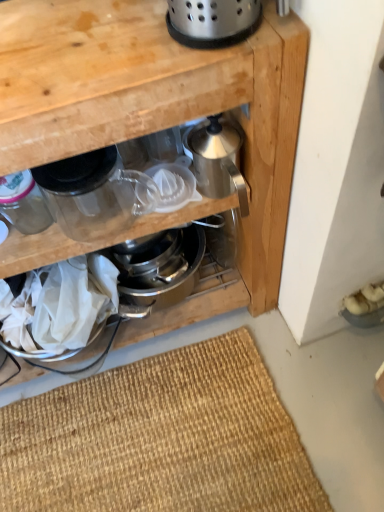
I want to click on transparent plastic juicer at center, which is counted as the 3th appliance, starting from the right, so click(166, 189).

What is the approximate width of transparent glass jar at left, the fourth appliance positioned from the right?

It is 3.05 inches.

This screenshot has height=512, width=384. Find the location of `polished stainless steel colander at upper center, marked as the second appliance in a right-to-left arrangement`. polished stainless steel colander at upper center, marked as the second appliance in a right-to-left arrangement is located at coordinates (212, 21).

The image size is (384, 512). Find the location of `cabinetry in front of the stainless steel kettle at center, the 1th appliance viewed from the right`. cabinetry in front of the stainless steel kettle at center, the 1th appliance viewed from the right is located at coordinates (158, 112).

Considering the sizes of objects satin silver juicer at center and stainless steel kettle at center, the 1th appliance viewed from the right, in the image provided, who is taller, satin silver juicer at center or stainless steel kettle at center, the 1th appliance viewed from the right,?

satin silver juicer at center.

Is satin silver juicer at center to the right of stainless steel kettle at center, the 1th appliance viewed from the right, from the viewer's perspective?

No, satin silver juicer at center is not to the right of stainless steel kettle at center, the 1th appliance viewed from the right.

Is point (189, 63) closer or farther from the camera than point (202, 173)?

Point (189, 63).

How different are the orientations of stainless steel kettle at center, which ranks as the 4th appliance in left-to-right order, and polished stainless steel colander at upper center, which ranks as the third appliance in left-to-right order, in degrees?

There is a 8.95-degree angle between the facing directions of stainless steel kettle at center, which ranks as the 4th appliance in left-to-right order, and polished stainless steel colander at upper center, which ranks as the third appliance in left-to-right order.

Is stainless steel kettle at center, the 1th appliance viewed from the right, situated inside polished stainless steel colander at upper center, marked as the second appliance in a right-to-left arrangement, or outside?

stainless steel kettle at center, the 1th appliance viewed from the right, is outside polished stainless steel colander at upper center, marked as the second appliance in a right-to-left arrangement.

From a real-world perspective, who is located higher, stainless steel kettle at center, which ranks as the 4th appliance in left-to-right order, or polished stainless steel colander at upper center, which ranks as the third appliance in left-to-right order?

In real-world perspective, polished stainless steel colander at upper center, which ranks as the third appliance in left-to-right order, is above.

Could brown woven mat at lower center be considered to be inside stainless steel kettle at center, which ranks as the 4th appliance in left-to-right order?

No, brown woven mat at lower center is not inside stainless steel kettle at center, which ranks as the 4th appliance in left-to-right order.

Between stainless steel kettle at center, the 1th appliance viewed from the right, and brown woven mat at lower center, which one appears on the right side from the viewer's perspective?

brown woven mat at lower center.

From the image's perspective, does stainless steel kettle at center, which ranks as the 4th appliance in left-to-right order, appear higher than brown woven mat at lower center?

Yes, from the image's perspective, stainless steel kettle at center, which ranks as the 4th appliance in left-to-right order, is above brown woven mat at lower center.

Considering the relative sizes of stainless steel kettle at center, the 1th appliance viewed from the right, and brown woven mat at lower center in the image provided, is stainless steel kettle at center, the 1th appliance viewed from the right, smaller than brown woven mat at lower center?

Yes.

Is transparent glass jar at left, the first appliance viewed from the left, next to transparent plastic juicer at center, marked as the 2th appliance in a left-to-right arrangement, and touching it?

No.

Does point (27, 169) appear closer or farther from the camera than point (173, 189)?

Point (27, 169) is closer to the camera than point (173, 189).

Does transparent glass jar at left, the fourth appliance positioned from the right, come in front of transparent plastic juicer at center, marked as the 2th appliance in a left-to-right arrangement?

That is True.

Is satin silver juicer at center located outside transparent plastic juicer at center, which is counted as the 3th appliance, starting from the right?

satin silver juicer at center lies outside transparent plastic juicer at center, which is counted as the 3th appliance, starting from the right,'s area.

Considering the positions of objects satin silver juicer at center and transparent plastic juicer at center, marked as the 2th appliance in a left-to-right arrangement, in the image provided, who is more to the left, satin silver juicer at center or transparent plastic juicer at center, marked as the 2th appliance in a left-to-right arrangement,?

Positioned to the left is satin silver juicer at center.

Is point (104, 138) positioned after point (172, 166)?

That is False.

Does satin silver juicer at center have a lesser width compared to transparent plastic juicer at center, marked as the 2th appliance in a left-to-right arrangement?

In fact, satin silver juicer at center might be wider than transparent plastic juicer at center, marked as the 2th appliance in a left-to-right arrangement.

From a real-world perspective, which is physically above, transparent glass jar at left, the fourth appliance positioned from the right, or satin silver juicer at center?

transparent glass jar at left, the fourth appliance positioned from the right, is physically above.

Based on the photo, which is more distant, (40, 215) or (90, 97)?

The point (40, 215) is farther from the camera.

At what (x,y) coordinates should I click in order to perform the action: click on the 2nd appliance behind the satin silver juicer at center, counting from the anchor's position. Please return your answer as a coordinate pair (x, y). The image size is (384, 512). Looking at the image, I should click on (23, 203).

Could you measure the distance between transparent glass jar at left, the fourth appliance positioned from the right, and satin silver juicer at center?

They are 9.89 inches apart.

Is brown woven mat at lower center closer to the viewer compared to transparent glass jar at left, the fourth appliance positioned from the right?

No, it is behind transparent glass jar at left, the fourth appliance positioned from the right.

Is transparent glass jar at left, the first appliance viewed from the left, at the back of brown woven mat at lower center?

No, brown woven mat at lower center's orientation is not away from transparent glass jar at left, the first appliance viewed from the left.

Is there a large distance between brown woven mat at lower center and transparent glass jar at left, the fourth appliance positioned from the right?

No, there isn't a large distance between brown woven mat at lower center and transparent glass jar at left, the fourth appliance positioned from the right.

Where is `cabinetry beneath the stainless steel kettle at center, which ranks as the 4th appliance in left-to-right order (from a real-world perspective)`? The height and width of the screenshot is (512, 384). cabinetry beneath the stainless steel kettle at center, which ranks as the 4th appliance in left-to-right order (from a real-world perspective) is located at coordinates (158, 112).

Find the location of a particular element. the 1st appliance below the polished stainless steel colander at upper center, which ranks as the third appliance in left-to-right order (from the image's perspective) is located at coordinates (215, 155).

Based on their spatial positions, is transparent plastic juicer at center, marked as the 2th appliance in a left-to-right arrangement, or brown woven mat at lower center closer to stainless steel kettle at center, which ranks as the 4th appliance in left-to-right order?

transparent plastic juicer at center, marked as the 2th appliance in a left-to-right arrangement.

Estimate the real-world distances between objects in this image. Which object is further from polished stainless steel colander at upper center, which ranks as the third appliance in left-to-right order, transparent glass jar at left, the first appliance viewed from the left, or brown woven mat at lower center?

brown woven mat at lower center.

Based on their spatial positions, is stainless steel kettle at center, the 1th appliance viewed from the right, or polished stainless steel colander at upper center, which ranks as the third appliance in left-to-right order, closer to transparent glass jar at upper left?

stainless steel kettle at center, the 1th appliance viewed from the right, is positioned closer to the anchor transparent glass jar at upper left.

Looking at the image, which one is located further to stainless steel kettle at center, the 1th appliance viewed from the right, transparent glass jar at upper left or transparent plastic juicer at center, which is counted as the 3th appliance, starting from the right?

transparent glass jar at upper left is further to stainless steel kettle at center, the 1th appliance viewed from the right.

Based on their spatial positions, is transparent glass jar at upper left or stainless steel kettle at center, the 1th appliance viewed from the right, closer to brown woven mat at lower center?

Based on the image, transparent glass jar at upper left appears to be nearer to brown woven mat at lower center.

Which object lies further to the anchor point transparent plastic juicer at center, which is counted as the 3th appliance, starting from the right, transparent glass jar at upper left or transparent glass jar at left, the fourth appliance positioned from the right?

transparent glass jar at left, the fourth appliance positioned from the right, lies further to transparent plastic juicer at center, which is counted as the 3th appliance, starting from the right, than the other object.

From the image, which object appears to be farther from polished stainless steel colander at upper center, marked as the second appliance in a right-to-left arrangement, satin silver juicer at center or transparent glass jar at left, the fourth appliance positioned from the right?

transparent glass jar at left, the fourth appliance positioned from the right, is positioned further to the anchor polished stainless steel colander at upper center, marked as the second appliance in a right-to-left arrangement.

Consider the image. Estimate the real-world distances between objects in this image. Which object is further from transparent glass jar at left, the first appliance viewed from the left, polished stainless steel colander at upper center, marked as the second appliance in a right-to-left arrangement, or transparent plastic juicer at center, which is counted as the 3th appliance, starting from the right?

polished stainless steel colander at upper center, marked as the second appliance in a right-to-left arrangement.

Locate an element on the screen. This screenshot has width=384, height=512. appliance between transparent glass jar at left, the fourth appliance positioned from the right, and polished stainless steel colander at upper center, marked as the second appliance in a right-to-left arrangement is located at coordinates (166, 189).

The width and height of the screenshot is (384, 512). I want to click on cabinetry between transparent glass jar at left, the fourth appliance positioned from the right, and brown woven mat at lower center from top to bottom, so click(158, 112).

I want to click on kitchen appliance between polished stainless steel colander at upper center, marked as the second appliance in a right-to-left arrangement, and brown woven mat at lower center in the up-down direction, so click(x=90, y=193).

Locate an element on the screen. Image resolution: width=384 pixels, height=512 pixels. kitchen appliance between transparent plastic juicer at center, marked as the 2th appliance in a left-to-right arrangement, and brown woven mat at lower center from top to bottom is located at coordinates coord(90,193).